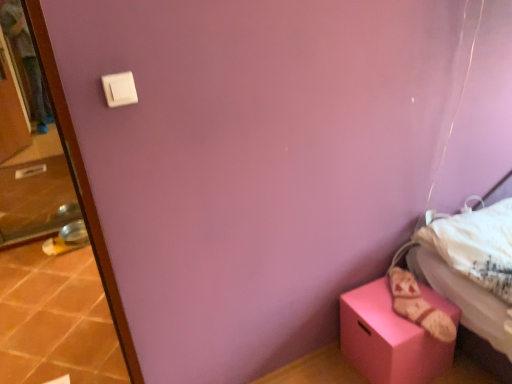
Locate an element on the screen. This screenshot has width=512, height=384. transparent glass screen door at left is located at coordinates (35, 194).

In order to click on matte pink box at lower right in this screenshot , I will do (x=388, y=339).

How different are the orientations of white plastic light switch at upper left and matte pink box at lower right in degrees?

The facing directions of white plastic light switch at upper left and matte pink box at lower right are 0.184 degrees apart.

Is the position of white plastic light switch at upper left less distant than that of matte pink box at lower right?

Yes, it is in front of matte pink box at lower right.

Between white plastic light switch at upper left and matte pink box at lower right, which one has less height?

white plastic light switch at upper left.

Is white plastic light switch at upper left looking in the opposite direction of matte pink box at lower right?

white plastic light switch at upper left does not have its back to matte pink box at lower right.

Does matte pink box at lower right have a lesser height compared to transparent glass screen door at left?

Yes, matte pink box at lower right is shorter than transparent glass screen door at left.

From the image's perspective, between matte pink box at lower right and transparent glass screen door at left, who is located below?

matte pink box at lower right, from the image's perspective.

Which object is positioned more to the right, matte pink box at lower right or transparent glass screen door at left?

From the viewer's perspective, matte pink box at lower right appears more on the right side.

Is matte pink box at lower right next to transparent glass screen door at left?

No, matte pink box at lower right is not next to transparent glass screen door at left.

Is transparent glass screen door at left facing away from terracotta tile at lower left?

transparent glass screen door at left does not have its back to terracotta tile at lower left.

Visually, is transparent glass screen door at left positioned to the left or to the right of terracotta tile at lower left?

Based on their positions, transparent glass screen door at left is located to the left of terracotta tile at lower left.

In terms of width, does transparent glass screen door at left look wider or thinner when compared to terracotta tile at lower left?

In the image, transparent glass screen door at left appears to be more narrow than terracotta tile at lower left.

Does point (16, 155) appear closer or farther from the camera than point (91, 272)?

Point (16, 155) is farther from the camera than point (91, 272).

From a real-world perspective, is white plastic light switch at upper left under transparent glass screen door at left?

No, from a real-world perspective, white plastic light switch at upper left is not under transparent glass screen door at left.

Considering their positions, is white plastic light switch at upper left located in front of or behind transparent glass screen door at left?

Visually, white plastic light switch at upper left is located in front of transparent glass screen door at left.

From the image's perspective, between white plastic light switch at upper left and transparent glass screen door at left, which one is located above?

transparent glass screen door at left is shown above in the image.

Which point is more distant from viewer, (117,76) or (38,107)?

The point (38,107) is farther from the camera.

Does terracotta tile at lower left turn towards transparent glass screen door at left?

No, terracotta tile at lower left is not facing towards transparent glass screen door at left.

Would you consider terracotta tile at lower left to be distant from transparent glass screen door at left?

terracotta tile at lower left is actually quite close to transparent glass screen door at left.

Which is more to the left, terracotta tile at lower left or transparent glass screen door at left?

Positioned to the left is transparent glass screen door at left.

Does point (51, 298) come closer to viewer compared to point (8, 221)?

Yes, point (51, 298) is closer to viewer.

The image size is (512, 384). In the image, there is a white plastic light switch at upper left. In order to click on tile below it (from the image's perspective) in this screenshot , I will do `click(55, 319)`.

Looking at this image, considering the positions of objects white plastic light switch at upper left and terracotta tile at lower left in the image provided, who is more to the left, white plastic light switch at upper left or terracotta tile at lower left?

From the viewer's perspective, terracotta tile at lower left appears more on the left side.

Does white plastic light switch at upper left contain terracotta tile at lower left?

No, terracotta tile at lower left is not surrounded by white plastic light switch at upper left.

From a real-world perspective, who is located lower, white plastic light switch at upper left or terracotta tile at lower left?

From a 3D spatial view, terracotta tile at lower left is below.

From a real-world perspective, is transparent glass screen door at left below white plastic light switch at upper left?

Yes, from a real-world perspective, transparent glass screen door at left is below white plastic light switch at upper left.

Is the depth of transparent glass screen door at left greater than that of white plastic light switch at upper left?

Yes, transparent glass screen door at left is further from the camera.

Does transparent glass screen door at left have a larger size compared to white plastic light switch at upper left?

Indeed, transparent glass screen door at left has a larger size compared to white plastic light switch at upper left.

Does point (22, 50) come farther from viewer compared to point (109, 84)?

Yes, point (22, 50) is behind point (109, 84).

Where is `light switch in front of the matte pink box at lower right`? This screenshot has height=384, width=512. light switch in front of the matte pink box at lower right is located at coordinates (119, 89).

Where is `screen door that appears behind the matte pink box at lower right`? screen door that appears behind the matte pink box at lower right is located at coordinates (35, 194).

Which object lies nearer to the anchor point white plastic light switch at upper left, transparent glass screen door at left or terracotta tile at lower left?

terracotta tile at lower left is positioned closer to the anchor white plastic light switch at upper left.

When comparing their distances from transparent glass screen door at left, does white plastic light switch at upper left or terracotta tile at lower left seem closer?

Among the two, terracotta tile at lower left is located nearer to transparent glass screen door at left.

When comparing their distances from matte pink box at lower right, does transparent glass screen door at left or terracotta tile at lower left seem closer?

Answer: Based on the image, terracotta tile at lower left appears to be nearer to matte pink box at lower right.

Considering their positions, is white plastic light switch at upper left positioned closer to transparent glass screen door at left than matte pink box at lower right?

The object closer to transparent glass screen door at left is matte pink box at lower right.

Which object lies nearer to the anchor point terracotta tile at lower left, transparent glass screen door at left or matte pink box at lower right?

transparent glass screen door at left is closer to terracotta tile at lower left.

When comparing their distances from matte pink box at lower right, does terracotta tile at lower left or white plastic light switch at upper left seem further?

The object further to matte pink box at lower right is terracotta tile at lower left.

Based on their spatial positions, is transparent glass screen door at left or white plastic light switch at upper left closer to matte pink box at lower right?

white plastic light switch at upper left is positioned closer to the anchor matte pink box at lower right.

When comparing their distances from white plastic light switch at upper left, does matte pink box at lower right or transparent glass screen door at left seem further?

transparent glass screen door at left is positioned further to the anchor white plastic light switch at upper left.

The height and width of the screenshot is (384, 512). Find the location of `tile between transparent glass screen door at left and white plastic light switch at upper left`. tile between transparent glass screen door at left and white plastic light switch at upper left is located at coordinates (55, 319).

You are a GUI agent. You are given a task and a screenshot of the screen. Output one action in this format:
    pyautogui.click(x=<x>, y=<y>)
    Task: Click on the tile between transparent glass screen door at left and matte pink box at lower right
    This screenshot has height=384, width=512.
    Given the screenshot: What is the action you would take?
    pyautogui.click(x=55, y=319)

Find the location of `light switch between terracotta tile at lower left and matte pink box at lower right from left to right`. light switch between terracotta tile at lower left and matte pink box at lower right from left to right is located at coordinates (119, 89).

Where is `light switch between transparent glass screen door at left and matte pink box at lower right in the horizontal direction`? This screenshot has height=384, width=512. light switch between transparent glass screen door at left and matte pink box at lower right in the horizontal direction is located at coordinates (119, 89).